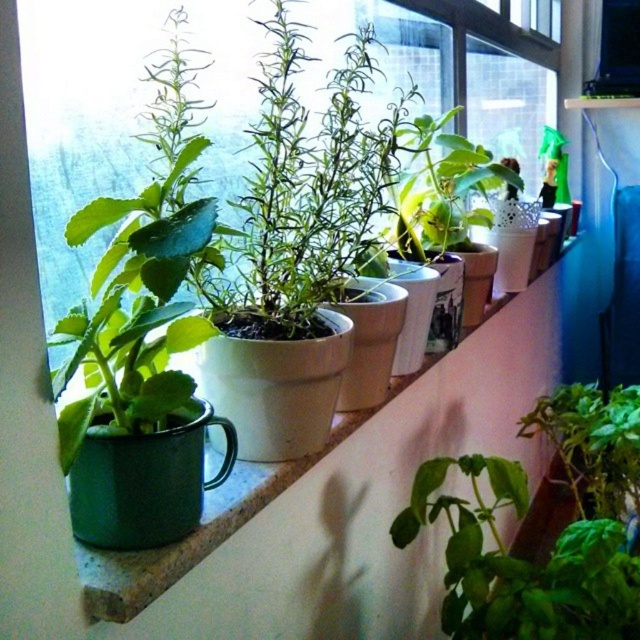
Question: Can you confirm if green ceramic mug at left is wider than green matte plant at center?

Choices:
 (A) yes
 (B) no

Answer: (A)

Question: Is green matte leafy plant at center bigger than green matte plant at center?

Choices:
 (A) no
 (B) yes

Answer: (B)

Question: Which point is farther to the camera?

Choices:
 (A) green matte leafy plant at center
 (B) green matte plant at center
 (C) green ceramic mug at left

Answer: (A)

Question: Which object is closer to the camera taking this photo?

Choices:
 (A) green matte leafy plant at center
 (B) green ceramic mug at left
 (C) green matte plant at center

Answer: (B)

Question: Can you confirm if green ceramic mug at left is positioned to the left of green matte leafy plant at center?

Choices:
 (A) yes
 (B) no

Answer: (A)

Question: Which object is farther from the camera taking this photo?

Choices:
 (A) green matte leafy plant at center
 (B) green ceramic mug at left
 (C) green matte plant at center

Answer: (A)